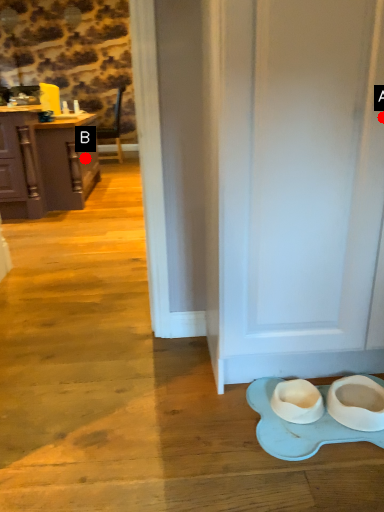
Question: Two points are circled on the image, labeled by A and B beside each circle. Among these points, which one is farthest from the camera?

Choices:
 (A) A is further
 (B) B is further

Answer: (B)